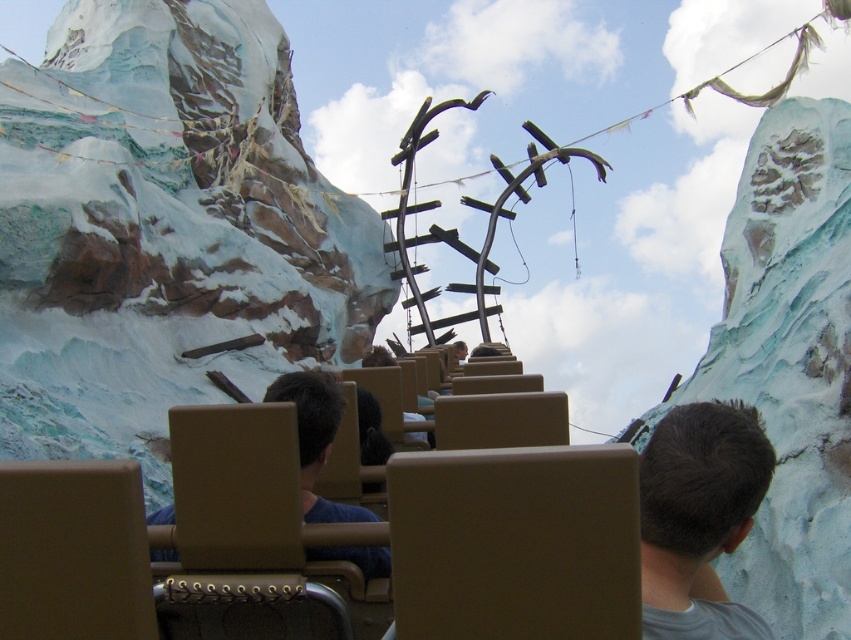
Question: Which point is farther from the camera taking this photo?

Choices:
 (A) (768, 461)
 (B) (460, 340)
 (C) (300, 442)

Answer: (B)

Question: Does dark brown hair at center have a lesser width compared to blue fabric shirt at center?

Choices:
 (A) yes
 (B) no

Answer: (A)

Question: Is blue fabric shirt at center to the right of brown leather jacket at center from the viewer's perspective?

Choices:
 (A) no
 (B) yes

Answer: (A)

Question: Does blue fabric shirt at center appear on the right side of brown leather jacket at center?

Choices:
 (A) no
 (B) yes

Answer: (A)

Question: Among these points, which one is farthest from the camera?

Choices:
 (A) (460, 349)
 (B) (310, 394)
 (C) (727, 454)

Answer: (A)

Question: Among these points, which one is farthest from the camera?

Choices:
 (A) (320, 396)
 (B) (703, 609)
 (C) (453, 342)

Answer: (C)